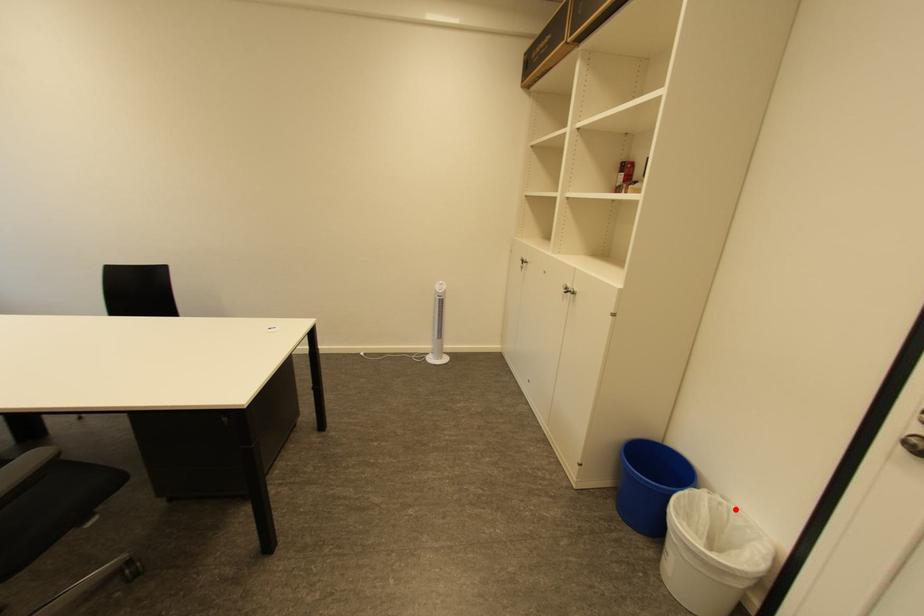
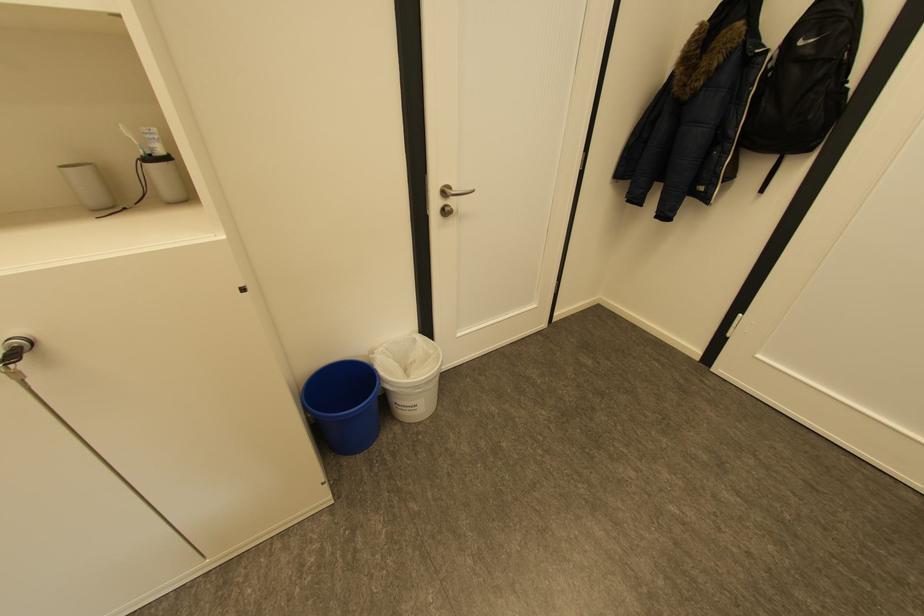
In the second image, find the point that corresponds to the highlighted location in the first image.

(394, 349)